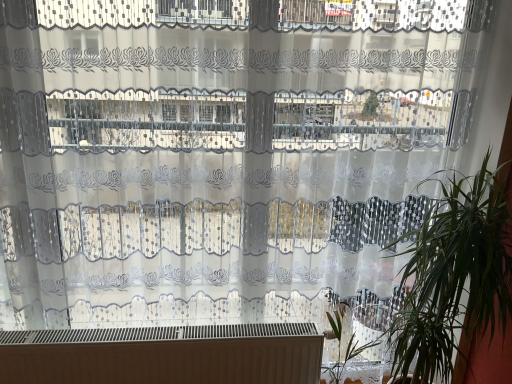
Question: From a real-world perspective, is green leafy plant at right positioned over green leafy plant at lower right based on gravity?

Choices:
 (A) no
 (B) yes

Answer: (B)

Question: Considering the relative sizes of green leafy plant at right and green leafy plant at lower right in the image provided, is green leafy plant at right taller than green leafy plant at lower right?

Choices:
 (A) no
 (B) yes

Answer: (B)

Question: Considering the relative positions of green leafy plant at right and green leafy plant at lower right in the image provided, is green leafy plant at right behind green leafy plant at lower right?

Choices:
 (A) yes
 (B) no

Answer: (B)

Question: Is green leafy plant at right turned away from green leafy plant at lower right?

Choices:
 (A) no
 (B) yes

Answer: (A)

Question: Is green leafy plant at right shorter than green leafy plant at lower right?

Choices:
 (A) yes
 (B) no

Answer: (B)

Question: From the image's perspective, is green leafy plant at right on top of green leafy plant at lower right?

Choices:
 (A) no
 (B) yes

Answer: (B)

Question: Is white matte heater at bottom far away from green leafy plant at right?

Choices:
 (A) no
 (B) yes

Answer: (A)

Question: From the image's perspective, does white matte heater at bottom appear higher than green leafy plant at right?

Choices:
 (A) yes
 (B) no

Answer: (B)

Question: Would you say green leafy plant at right is part of white matte heater at bottom's contents?

Choices:
 (A) yes
 (B) no

Answer: (B)

Question: Can you confirm if white matte heater at bottom is smaller than green leafy plant at right?

Choices:
 (A) no
 (B) yes

Answer: (B)

Question: Is white matte heater at bottom taller than green leafy plant at right?

Choices:
 (A) yes
 (B) no

Answer: (B)

Question: From a real-world perspective, is white matte heater at bottom on top of green leafy plant at right?

Choices:
 (A) no
 (B) yes

Answer: (A)

Question: Is green leafy plant at right turned away from white matte heater at bottom?

Choices:
 (A) no
 (B) yes

Answer: (A)